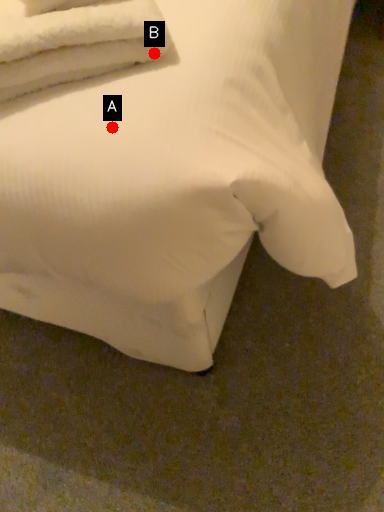
Question: Two points are circled on the image, labeled by A and B beside each circle. Which point is closer to the camera?

Choices:
 (A) A is closer
 (B) B is closer

Answer: (A)